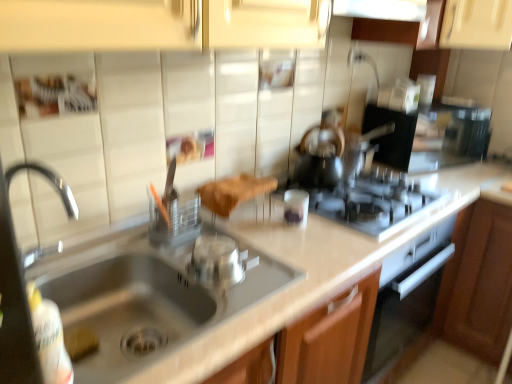
The width and height of the screenshot is (512, 384). Identify the location of free point to the right of silver metallic pot at center, placed as the 1th appliance when sorted from front to back. (283, 273).